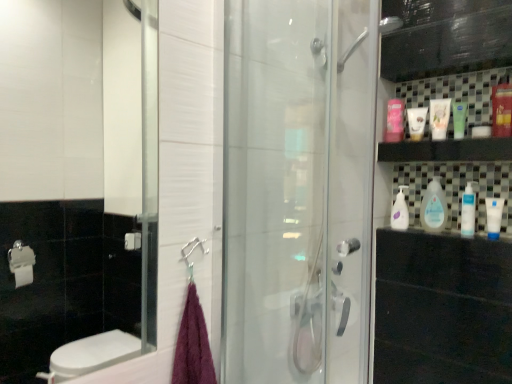
Question: Is white glossy bottle at right, the first cleaning product from the right, taller than white glossy bottle at upper right, which is the third cleaning product from front to back?

Choices:
 (A) no
 (B) yes

Answer: (B)

Question: Does white glossy bottle at right, the first cleaning product from the right, have a greater width compared to white glossy bottle at upper right, which is the third cleaning product from front to back?

Choices:
 (A) yes
 (B) no

Answer: (B)

Question: Is white glossy bottle at right, acting as the 3th cleaning product starting from the left, looking in the opposite direction of white glossy bottle at upper right, which is the third cleaning product from front to back?

Choices:
 (A) no
 (B) yes

Answer: (A)

Question: From a real-world perspective, is white glossy bottle at right, the third cleaning product from the back, positioned over white glossy bottle at upper right, which is the third cleaning product from front to back, based on gravity?

Choices:
 (A) yes
 (B) no

Answer: (A)

Question: Can you confirm if white glossy bottle at right, the third cleaning product from the back, is positioned to the left of white glossy bottle at upper right, the first cleaning product viewed from the left?

Choices:
 (A) no
 (B) yes

Answer: (A)

Question: From the image's perspective, is transparent glass shower door at center above or below green matte tube at upper right, arranged as the 4th mouthwash when viewed from the left?

Choices:
 (A) above
 (B) below

Answer: (B)

Question: From a real-world perspective, is transparent glass shower door at center physically located above or below green matte tube at upper right, which is the third mouthwash in right-to-left order?

Choices:
 (A) below
 (B) above

Answer: (A)

Question: Is transparent glass shower door at center wider or thinner than green matte tube at upper right, which is the third mouthwash in right-to-left order?

Choices:
 (A) wide
 (B) thin

Answer: (A)

Question: Is transparent glass shower door at center inside or outside of green matte tube at upper right, arranged as the 4th mouthwash when viewed from the left?

Choices:
 (A) outside
 (B) inside

Answer: (A)

Question: Based on their sizes in the image, would you say white glossy bottle at upper right, which ranks as the first cleaning product in back-to-front order, is bigger or smaller than red plastic mouthwash at upper right, which is counted as the 6th mouthwash, starting from the left?

Choices:
 (A) small
 (B) big

Answer: (A)

Question: From a real-world perspective, is white glossy bottle at upper right, the third cleaning product from the right, above or below red plastic mouthwash at upper right, which is counted as the 6th mouthwash, starting from the left?

Choices:
 (A) below
 (B) above

Answer: (A)

Question: Relative to red plastic mouthwash at upper right, which is counted as the 6th mouthwash, starting from the left, is white glossy bottle at upper right, which ranks as the first cleaning product in back-to-front order, in front or behind?

Choices:
 (A) behind
 (B) front

Answer: (A)

Question: From the image's perspective, is white glossy bottle at upper right, the third cleaning product from the right, positioned above or below red plastic mouthwash at upper right, which ranks as the 1th mouthwash in right-to-left order?

Choices:
 (A) above
 (B) below

Answer: (B)

Question: Considering the relative positions of white matte tube at upper right, the 2th mouthwash in the left-to-right sequence, and blue matte tube at right, positioned as the fifth mouthwash in left-to-right order, in the image provided, is white matte tube at upper right, the 2th mouthwash in the left-to-right sequence, to the left or to the right of blue matte tube at right, positioned as the fifth mouthwash in left-to-right order,?

Choices:
 (A) left
 (B) right

Answer: (A)

Question: Is white matte tube at upper right, the 5th mouthwash when ordered from right to left, bigger or smaller than blue matte tube at right, acting as the second mouthwash starting from the right?

Choices:
 (A) small
 (B) big

Answer: (B)